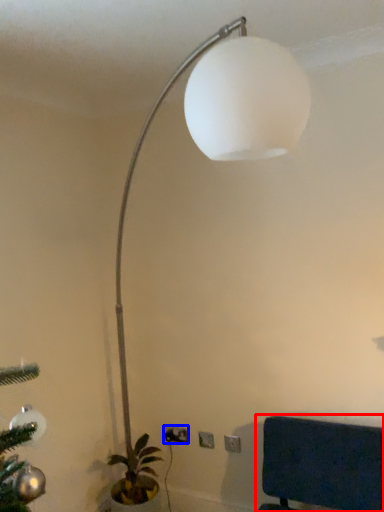
Question: Which object is further to the camera taking this photo, furniture (highlighted by a red box) or electric outlet (highlighted by a blue box)?

Choices:
 (A) furniture
 (B) electric outlet

Answer: (B)